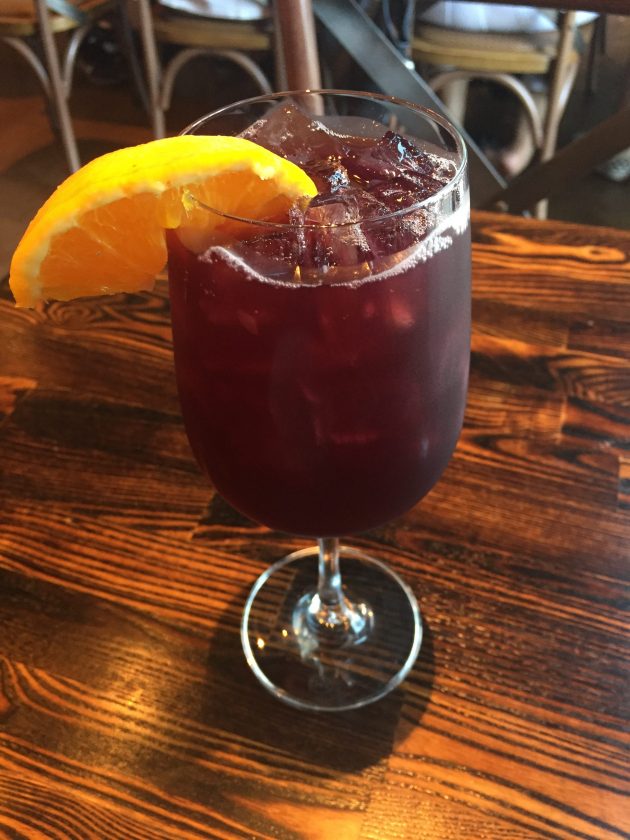
At what (x,y) coordinates should I click in order to perform the action: click on seat. Please return your answer as a coordinate pair (x, y). Looking at the image, I should click on click(472, 51), click(197, 39), click(14, 23).